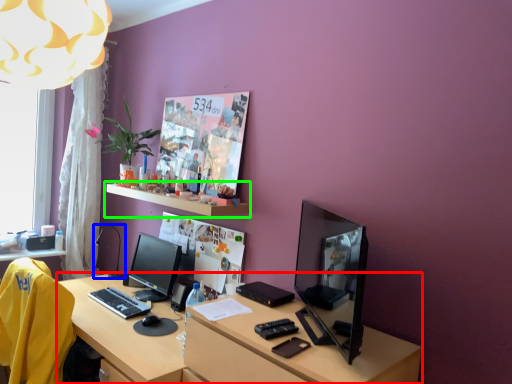
Question: Based on their relative distances, which object is farther from desk (highlighted by a red box)? Choose from table lamp (highlighted by a blue box) and shelf (highlighted by a green box).

Choices:
 (A) table lamp
 (B) shelf

Answer: (A)